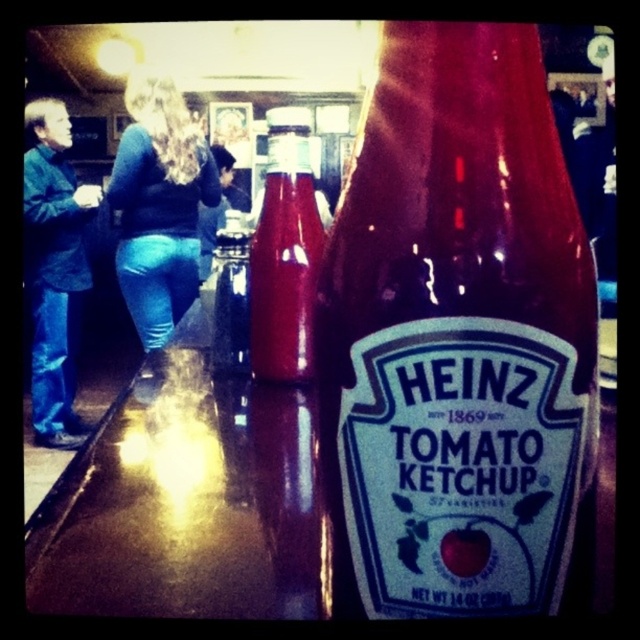
You are a customer at a restaurant counter. You see jeans at left and blue jeans at lower left. Which pair of jeans is closer to the left side of the counter?

The jeans at left is closer to the left side of the counter because it is positioned to the left of blue jeans at lower left.

Looking at this image, you are a photographer standing at a distance and want to capture the Heinz Tomato Ketchup bottle in focus. The camera you are using has a depth of field that can only sharply focus objects within 3 meters. Is the point at coordinates point (61, 374) within the camera focus range?

The distance of point (61, 374) from the camera is 3.45 meters, which is beyond the camera focus range of 3 meters. Therefore, the point at coordinates point (61, 374) will not be in focus.

You are a customer at a diner and you see a translucent glass bottle at center and blue jeans at lower left. Which object is larger in size?

The blue jeans at lower left are larger than the translucent glass bottle at center.